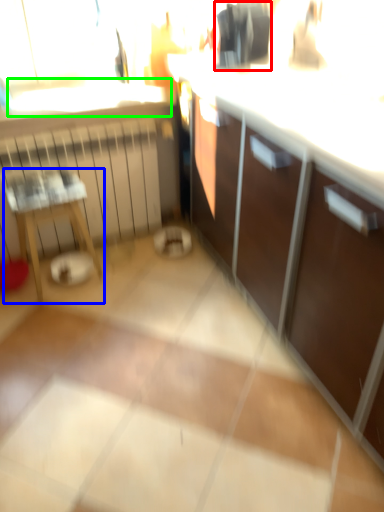
Question: Estimate the real-world distances between objects in this image. Which object is closer to appliance (highlighted by a red box), furniture (highlighted by a blue box) or window sill (highlighted by a green box)?

Choices:
 (A) furniture
 (B) window sill

Answer: (B)